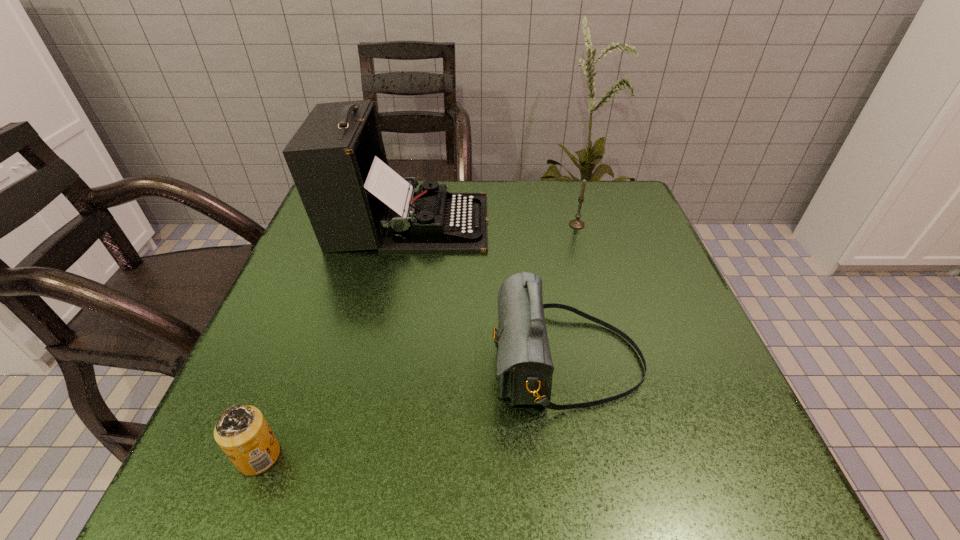
You are a GUI agent. You are given a task and a screenshot of the screen. Output one action in this format:
    pyautogui.click(x=<x>, y=<y>)
    Task: Click on the vacant space that satisfies the following two spatial constraints: 1. inside the open case of the tallest object; 2. on the left side of the second tallest object
    Image resolution: width=960 pixels, height=540 pixels.
    Given the screenshot: What is the action you would take?
    pyautogui.click(x=379, y=361)

This screenshot has width=960, height=540. Find the location of `free space that satisfies the following two spatial constraints: 1. on the back side of the shoulder bag; 2. on the left side of the shortest object`. free space that satisfies the following two spatial constraints: 1. on the back side of the shoulder bag; 2. on the left side of the shortest object is located at coordinates (296, 361).

The image size is (960, 540). Find the location of `vacant point that satisfies the following two spatial constraints: 1. inside the open case of the third shortest object; 2. on the left side of the tallest object`. vacant point that satisfies the following two spatial constraints: 1. inside the open case of the third shortest object; 2. on the left side of the tallest object is located at coordinates (379, 361).

I want to click on free region that satisfies the following two spatial constraints: 1. on the back side of the candle; 2. on the right side of the third farthest object, so click(x=542, y=225).

Identify the location of vacant space that satisfies the following two spatial constraints: 1. inside the open case of the third tallest object; 2. on the right side of the tallest object. (407, 225).

The height and width of the screenshot is (540, 960). I want to click on vacant point that satisfies the following two spatial constraints: 1. inside the open case of the typewriter; 2. on the right side of the third shortest object, so click(x=379, y=361).

Locate an element on the screen. This screenshot has height=540, width=960. vacant space that satisfies the following two spatial constraints: 1. inside the open case of the third farthest object; 2. on the right side of the tallest object is located at coordinates (379, 361).